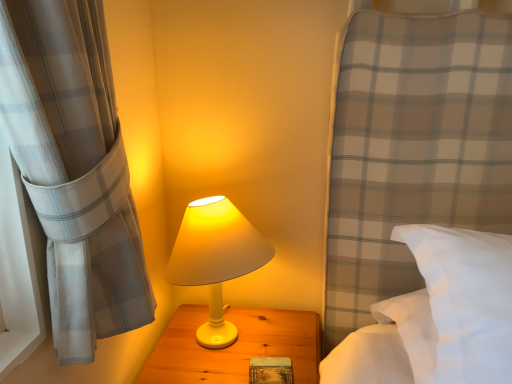
Question: From the image's perspective, does white matte wood nightstand at center appear lower than white soft pillow at right?

Choices:
 (A) yes
 (B) no

Answer: (A)

Question: Is white matte wood nightstand at center oriented towards white soft pillow at right?

Choices:
 (A) no
 (B) yes

Answer: (A)

Question: Is white matte wood nightstand at center to the left of white soft pillow at right from the viewer's perspective?

Choices:
 (A) no
 (B) yes

Answer: (B)

Question: From the image's perspective, does white matte wood nightstand at center appear higher than white soft pillow at right?

Choices:
 (A) yes
 (B) no

Answer: (B)

Question: Is white matte wood nightstand at center not within white soft pillow at right?

Choices:
 (A) yes
 (B) no

Answer: (A)

Question: Is white matte wood nightstand at center facing away from white soft pillow at right?

Choices:
 (A) no
 (B) yes

Answer: (A)

Question: Could you tell me if white soft pillow at right is facing wooden textured book at center?

Choices:
 (A) no
 (B) yes

Answer: (A)

Question: Considering the relative sizes of white soft pillow at right and wooden textured book at center in the image provided, is white soft pillow at right taller than wooden textured book at center?

Choices:
 (A) no
 (B) yes

Answer: (B)

Question: Does white soft pillow at right have a greater width compared to wooden textured book at center?

Choices:
 (A) no
 (B) yes

Answer: (B)

Question: Does white soft pillow at right have a smaller size compared to wooden textured book at center?

Choices:
 (A) yes
 (B) no

Answer: (B)

Question: Can you confirm if white soft pillow at right is thinner than wooden textured book at center?

Choices:
 (A) no
 (B) yes

Answer: (A)

Question: Is white soft pillow at right turned away from wooden textured book at center?

Choices:
 (A) no
 (B) yes

Answer: (A)

Question: From the image's perspective, is white soft pillow at right beneath white matte lamp at center?

Choices:
 (A) no
 (B) yes

Answer: (A)